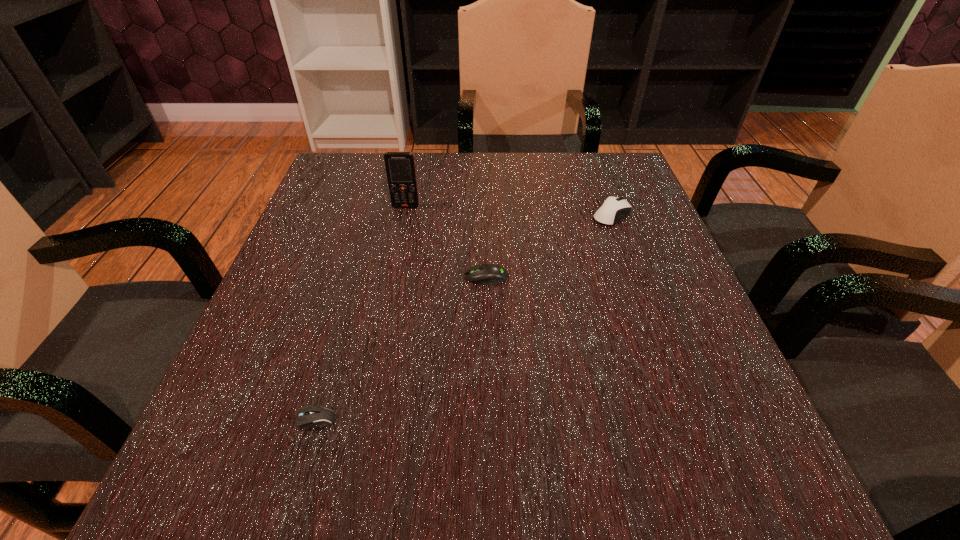
Image resolution: width=960 pixels, height=540 pixels. Find the location of `vacant position located 0.150m on the wheel side of the second farthest computer mouse`. vacant position located 0.150m on the wheel side of the second farthest computer mouse is located at coordinates (383, 278).

This screenshot has height=540, width=960. Find the location of `vacant space located on the wheel side of the second farthest computer mouse`. vacant space located on the wheel side of the second farthest computer mouse is located at coordinates (421, 278).

Find the location of a particular element. This screenshot has width=960, height=540. free space located 0.180m on the wheel side of the second farthest computer mouse is located at coordinates (368, 278).

Find the location of a particular element. This screenshot has height=540, width=960. blank area located on the left of the shortest computer mouse is located at coordinates (225, 437).

This screenshot has width=960, height=540. Find the location of `cellular telephone present at the far edge`. cellular telephone present at the far edge is located at coordinates (400, 167).

Locate an element on the screen. The height and width of the screenshot is (540, 960). mouse that is at the far edge is located at coordinates (613, 209).

The width and height of the screenshot is (960, 540). What are the coordinates of `object that is at the near edge` in the screenshot? It's located at (310, 415).

Find the location of `object that is at the left edge`. object that is at the left edge is located at coordinates click(310, 415).

Locate an element on the screen. The height and width of the screenshot is (540, 960). object located at the right edge is located at coordinates (613, 209).

Find the location of a particular element. The height and width of the screenshot is (540, 960). object situated at the near left corner is located at coordinates (310, 415).